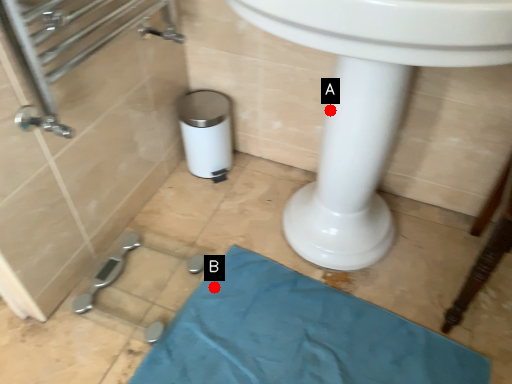
Question: Two points are circled on the image, labeled by A and B beside each circle. Among these points, which one is nearest to the camera?

Choices:
 (A) A is closer
 (B) B is closer

Answer: (A)